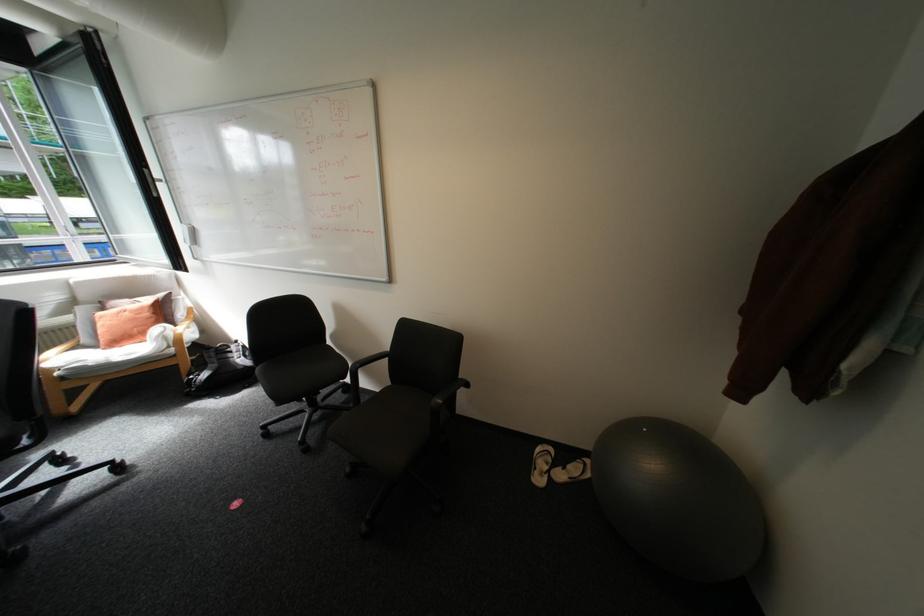
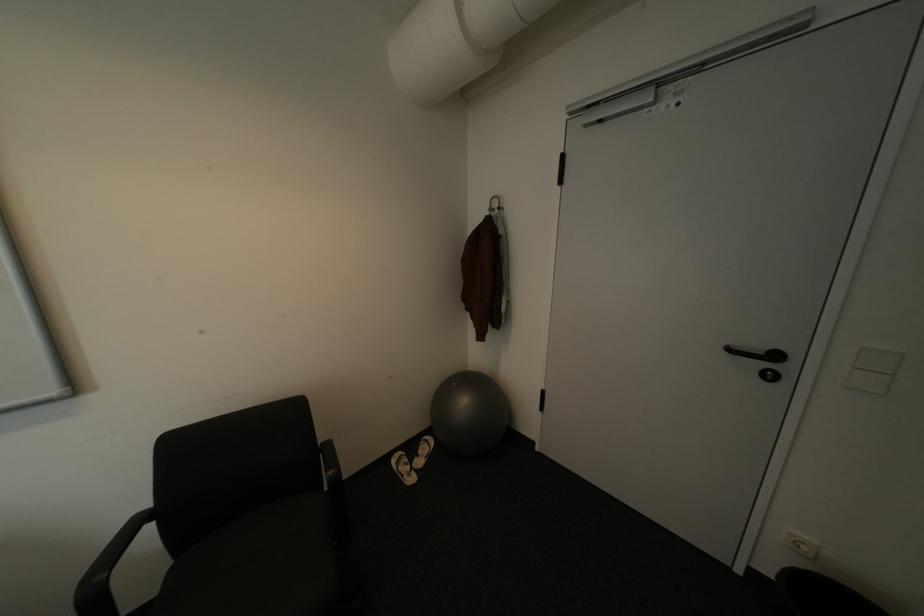
Locate, in the second image, the point that corresponds to pixel 573 469 in the first image.

(428, 456)